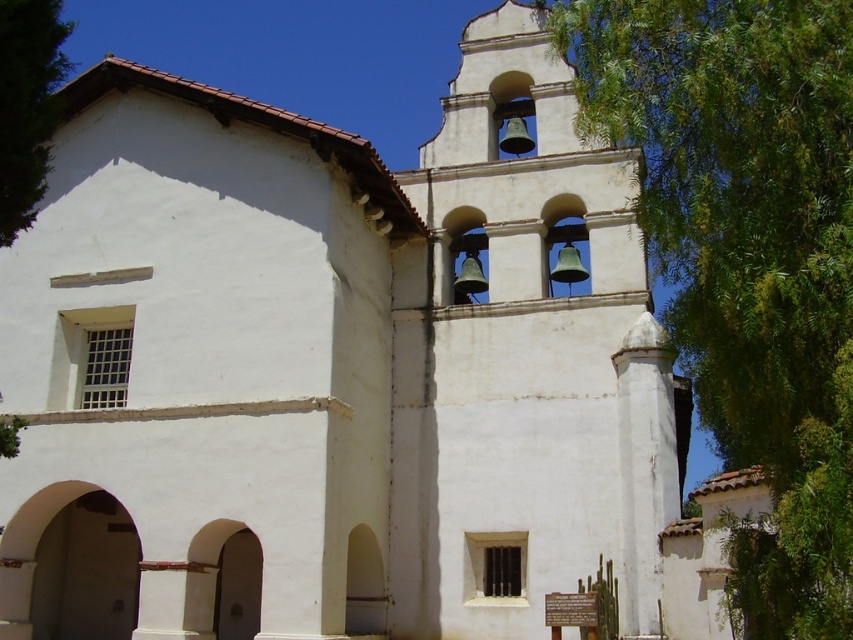
Question: Is green leafy tree at upper right closer to camera compared to green leafy tree at upper left?

Choices:
 (A) yes
 (B) no

Answer: (A)

Question: Which point is farther from the camera taking this photo?

Choices:
 (A) (44, 120)
 (B) (598, 17)

Answer: (B)

Question: Observing the image, what is the correct spatial positioning of green leafy tree at upper right in reference to green leafy tree at upper left?

Choices:
 (A) above
 (B) below

Answer: (B)

Question: Is green leafy tree at upper right to the right of green leafy tree at upper left from the viewer's perspective?

Choices:
 (A) no
 (B) yes

Answer: (B)